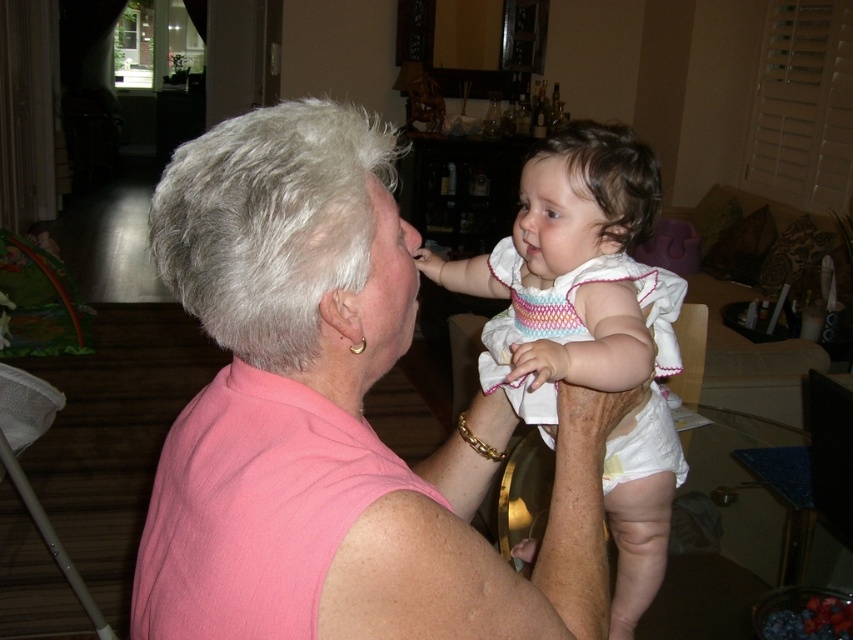
Is point (326, 209) less distant than point (625, 156)?

Yes, point (326, 209) is closer to viewer.

Which is behind, point (297, 605) or point (566, 179)?

Positioned behind is point (566, 179).

At what (x,y) coordinates should I click in order to perform the action: click on pink fabric at center. Please return your answer as a coordinate pair (x, y). Looking at the image, I should click on (329, 417).